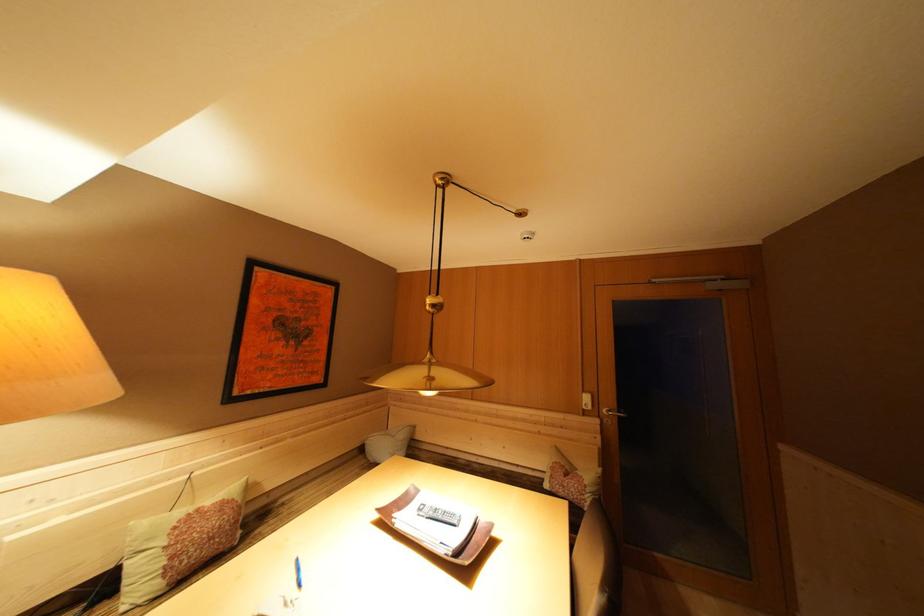
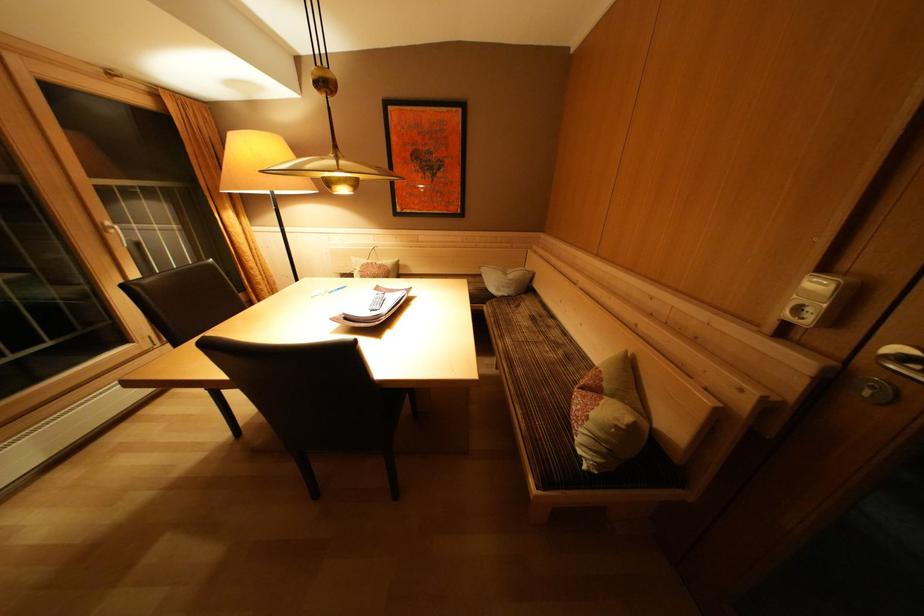
Where in the second image is the point corresponding to (592,487) from the first image?

(600, 419)